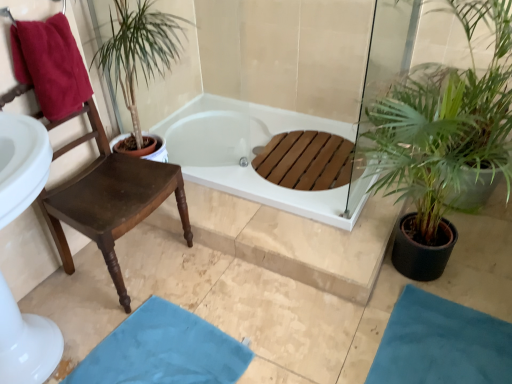
What is the approximate height of white glossy bathtub at center?

The height of white glossy bathtub at center is 3.64 inches.

What is the approximate height of green leafy plant at right?

green leafy plant at right is 1.15 meters in height.

This screenshot has width=512, height=384. Describe the element at coordinates (441, 343) in the screenshot. I see `blue fabric bath mat at lower right, which ranks as the second bath mat in left-to-right order` at that location.

What do you see at coordinates (50, 65) in the screenshot?
I see `maroon cotton towel at left` at bounding box center [50, 65].

You are a GUI agent. You are given a task and a screenshot of the screen. Output one action in this format:
    pyautogui.click(x=<x>, y=<y>)
    Task: Click on the white glossy bathtub at center
    
    Given the screenshot: What is the action you would take?
    pyautogui.click(x=248, y=153)

From the image's perspective, is maroon cotton towel at left located beneath brown wood chair at left?

Incorrect, from the image's perspective, maroon cotton towel at left is higher than brown wood chair at left.

How much distance is there between maroon cotton towel at left and brown wood chair at left?

A distance of 11.53 inches exists between maroon cotton towel at left and brown wood chair at left.

Between point (52, 86) and point (165, 164), which one is positioned behind?

The point (165, 164) is behind.

From the image's perspective, is green leafy plant at right on brown wood chair at left?

Indeed, from the image's perspective, green leafy plant at right is shown above brown wood chair at left.

Between green leafy plant at right and brown wood chair at left, which one has larger width?

green leafy plant at right is wider.

What are the coordinates of `chair that is on the left side of green leafy plant at right` in the screenshot? It's located at (109, 199).

How distant is green leafy plant at right from brown wood chair at left?

green leafy plant at right and brown wood chair at left are 1.06 meters apart.

How different are the orientations of blue fabric bath mat at lower center, placed as the first bath mat when sorted from left to right, and white glossy bathtub at center in degrees?

84.3 degrees.

From a real-world perspective, is blue fabric bath mat at lower center, placed as the first bath mat when sorted from left to right, on top of white glossy bathtub at center?

No, from a real-world perspective, blue fabric bath mat at lower center, placed as the first bath mat when sorted from left to right, is not above white glossy bathtub at center.

Is blue fabric bath mat at lower center, placed as the first bath mat when sorted from left to right, at the right side of white glossy bathtub at center?

In fact, blue fabric bath mat at lower center, placed as the first bath mat when sorted from left to right, is to the left of white glossy bathtub at center.

I want to click on bathtub that is above the blue fabric bath mat at lower center, placed as the first bath mat when sorted from left to right (from a real-world perspective), so click(x=248, y=153).

From a real-world perspective, which object rests below the other?

blue fabric bath mat at lower center, which is counted as the 2th bath mat, starting from the right, from a real-world perspective.

The image size is (512, 384). I want to click on the 2nd bath mat below the green leafy plant at right (from a real-world perspective), so click(164, 350).

Is green leafy plant at right smaller than blue fabric bath mat at lower center, which is counted as the 2th bath mat, starting from the right?

Actually, green leafy plant at right might be larger than blue fabric bath mat at lower center, which is counted as the 2th bath mat, starting from the right.

Considering the sizes of objects green leafy plant at right and blue fabric bath mat at lower right, which ranks as the second bath mat in left-to-right order, in the image provided, who is smaller, green leafy plant at right or blue fabric bath mat at lower right, which ranks as the second bath mat in left-to-right order,?

With smaller size is blue fabric bath mat at lower right, which ranks as the second bath mat in left-to-right order.

Is green leafy plant at right facing away from blue fabric bath mat at lower right, which appears as the first bath mat when viewed from the right?

That's not correct — green leafy plant at right is not looking away from blue fabric bath mat at lower right, which appears as the first bath mat when viewed from the right.

This screenshot has height=384, width=512. I want to click on houseplant located in front of the blue fabric bath mat at lower right, which appears as the first bath mat when viewed from the right, so click(444, 138).

Between green leafy plant at right and blue fabric bath mat at lower right, which ranks as the second bath mat in left-to-right order, which one has less height?

With less height is blue fabric bath mat at lower right, which ranks as the second bath mat in left-to-right order.

Is blue fabric bath mat at lower right, which appears as the first bath mat when viewed from the right, inside maroon cotton towel at left?

No, blue fabric bath mat at lower right, which appears as the first bath mat when viewed from the right, is not inside maroon cotton towel at left.

Considering the sizes of objects maroon cotton towel at left and blue fabric bath mat at lower right, which appears as the first bath mat when viewed from the right, in the image provided, who is smaller, maroon cotton towel at left or blue fabric bath mat at lower right, which appears as the first bath mat when viewed from the right,?

blue fabric bath mat at lower right, which appears as the first bath mat when viewed from the right, is smaller.

Which is behind, maroon cotton towel at left or blue fabric bath mat at lower right, which appears as the first bath mat when viewed from the right?

Positioned behind is maroon cotton towel at left.

Looking at their sizes, would you say maroon cotton towel at left is wider or thinner than blue fabric bath mat at lower right, which ranks as the second bath mat in left-to-right order?

maroon cotton towel at left is thinner than blue fabric bath mat at lower right, which ranks as the second bath mat in left-to-right order.

Does maroon cotton towel at left have a lesser height compared to white glossy bathtub at center?

No, maroon cotton towel at left is not shorter than white glossy bathtub at center.

Is there a large distance between maroon cotton towel at left and white glossy bathtub at center?

maroon cotton towel at left is near white glossy bathtub at center, not far away.

From a real-world perspective, is maroon cotton towel at left on white glossy bathtub at center?

Correct, in the physical world, maroon cotton towel at left is higher than white glossy bathtub at center.

You are a GUI agent. You are given a task and a screenshot of the screen. Output one action in this format:
    pyautogui.click(x=<x>, y=<y>)
    Task: Click on the beach towel in front of the white glossy bathtub at center
    The width and height of the screenshot is (512, 384).
    Given the screenshot: What is the action you would take?
    pyautogui.click(x=50, y=65)

Locate an element on the screen. beach towel above the brown wood chair at left (from the image's perspective) is located at coordinates 50,65.

Locate an element on the screen. The width and height of the screenshot is (512, 384). houseplant that appears on the right of brown wood chair at left is located at coordinates (444, 138).

From the image, which object appears to be nearer to blue fabric bath mat at lower center, placed as the first bath mat when sorted from left to right, green leafy plant at right or maroon cotton towel at left?

Among the two, maroon cotton towel at left is located nearer to blue fabric bath mat at lower center, placed as the first bath mat when sorted from left to right.

Which object lies nearer to the anchor point brown wood chair at left, green leafy plant at right or white glossy bathtub at center?

white glossy bathtub at center is positioned closer to the anchor brown wood chair at left.

When comparing their distances from maroon cotton towel at left, does white glossy bathtub at center or brown wood chair at left seem further?

Among the two, white glossy bathtub at center is located further to maroon cotton towel at left.

From the image, which object appears to be nearer to blue fabric bath mat at lower center, placed as the first bath mat when sorted from left to right, white glossy bathtub at center or blue fabric bath mat at lower right, which ranks as the second bath mat in left-to-right order?

blue fabric bath mat at lower right, which ranks as the second bath mat in left-to-right order.

Which object lies further to the anchor point white glossy bathtub at center, green leafy plant at right or blue fabric bath mat at lower center, placed as the first bath mat when sorted from left to right?

blue fabric bath mat at lower center, placed as the first bath mat when sorted from left to right, lies further to white glossy bathtub at center than the other object.

Considering their positions, is brown wood chair at left positioned further to blue fabric bath mat at lower center, which is counted as the 2th bath mat, starting from the right, than blue fabric bath mat at lower right, which ranks as the second bath mat in left-to-right order?

The object further to blue fabric bath mat at lower center, which is counted as the 2th bath mat, starting from the right, is blue fabric bath mat at lower right, which ranks as the second bath mat in left-to-right order.

Based on their spatial positions, is white glossy bathtub at center or blue fabric bath mat at lower right, which appears as the first bath mat when viewed from the right, closer to green leafy plant at right?

blue fabric bath mat at lower right, which appears as the first bath mat when viewed from the right, is closer to green leafy plant at right.

Based on their spatial positions, is white glossy bathtub at center or blue fabric bath mat at lower center, placed as the first bath mat when sorted from left to right, further from brown wood chair at left?

white glossy bathtub at center.

Identify the location of bathtub situated between maroon cotton towel at left and blue fabric bath mat at lower right, which ranks as the second bath mat in left-to-right order, from left to right. (248, 153).

Find the location of a particular element. This screenshot has height=384, width=512. bathtub between green leafy plant at right and blue fabric bath mat at lower right, which ranks as the second bath mat in left-to-right order, from top to bottom is located at coordinates (248, 153).

Locate an element on the screen. The image size is (512, 384). bath mat between maroon cotton towel at left and blue fabric bath mat at lower right, which ranks as the second bath mat in left-to-right order is located at coordinates (164, 350).

Where is `bathtub between blue fabric bath mat at lower center, which is counted as the 2th bath mat, starting from the right, and blue fabric bath mat at lower right, which ranks as the second bath mat in left-to-right order, in the horizontal direction`? This screenshot has height=384, width=512. bathtub between blue fabric bath mat at lower center, which is counted as the 2th bath mat, starting from the right, and blue fabric bath mat at lower right, which ranks as the second bath mat in left-to-right order, in the horizontal direction is located at coordinates (248, 153).